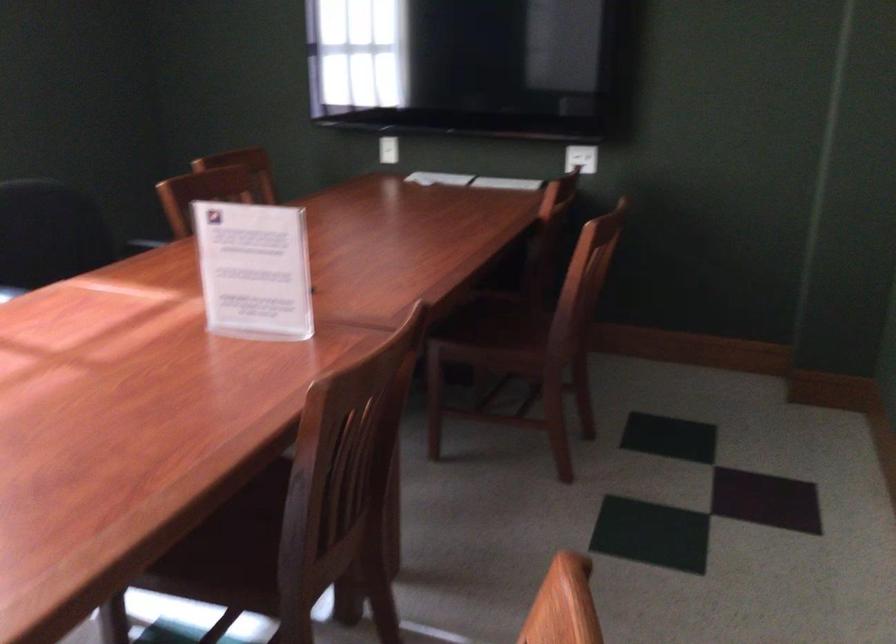
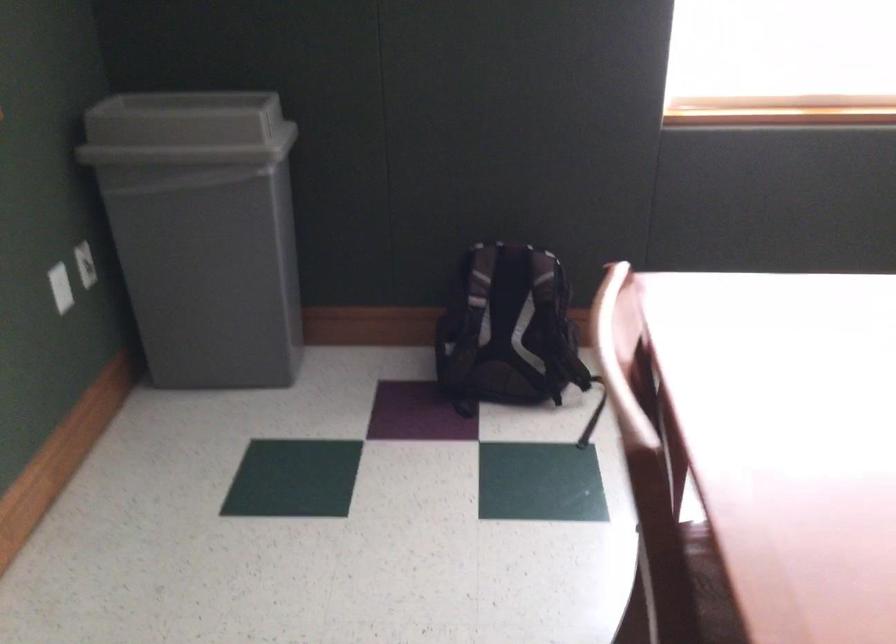
The first image is from the beginning of the video and the second image is from the end. How did the camera likely rotate when shooting the video?

The camera's rotation is toward left-down.